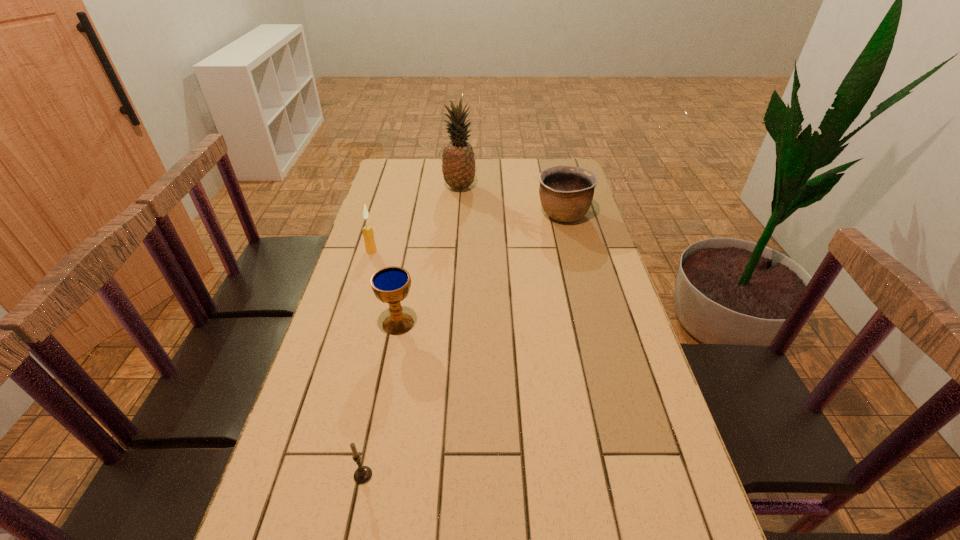
Locate an element on the screen. free space between the fourth nearest object and the left candle is located at coordinates (468, 232).

Find the location of a particular element. This screenshot has height=540, width=960. free spot between the farther candle and the pineapple is located at coordinates (416, 219).

Identify the location of free space between the taller candle and the rightmost object. This screenshot has height=540, width=960. pyautogui.click(x=468, y=232).

You are a GUI agent. You are given a task and a screenshot of the screen. Output one action in this format:
    pyautogui.click(x=<x>, y=<y>)
    Task: Click on the unoccupied position between the left candle and the shorter candle
    
    Given the screenshot: What is the action you would take?
    pyautogui.click(x=368, y=363)

The width and height of the screenshot is (960, 540). In order to click on free area in between the fourth farthest object and the right candle in this screenshot , I will do `click(380, 400)`.

Locate an element on the screen. unoccupied area between the pottery and the farthest object is located at coordinates (512, 201).

Find the location of a particular element. free space that is in between the shorter candle and the chalice is located at coordinates (380, 400).

You are a GUI agent. You are given a task and a screenshot of the screen. Output one action in this format:
    pyautogui.click(x=<x>, y=<y>)
    Task: Click on the free space between the farthest object and the nearer candle
    
    Given the screenshot: What is the action you would take?
    pyautogui.click(x=411, y=331)

Identify the location of object that stands as the closest to the shorter candle. The height and width of the screenshot is (540, 960). (391, 285).

Point out which object is positioned as the fourth nearest to the rightmost object. Please provide its 2D coordinates. Your answer should be formatted as a tuple, i.e. [(x, y)], where the tuple contains the x and y coordinates of a point satisfying the conditions above.

[(363, 474)]